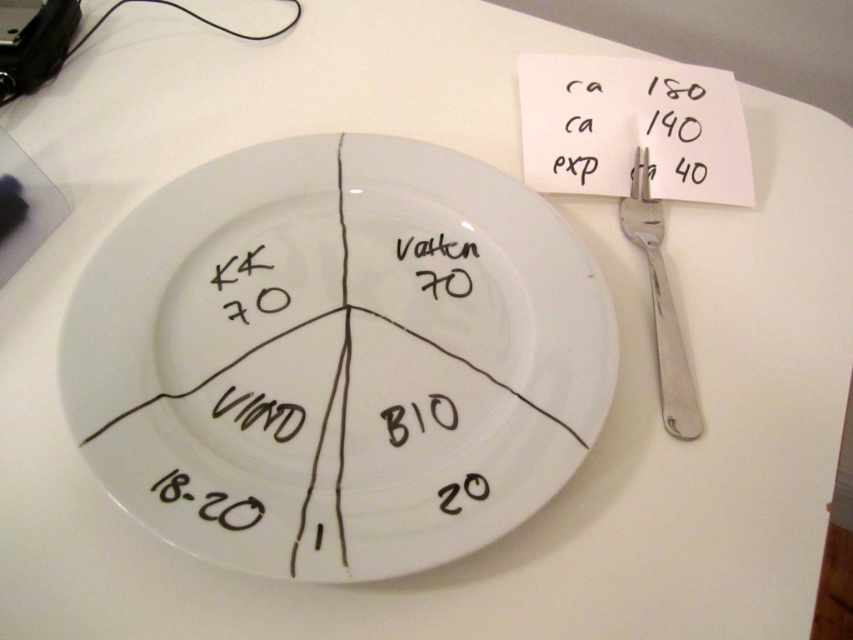
Question: Can you confirm if white paper at upper right is positioned to the left of white matte text at center?

Choices:
 (A) yes
 (B) no

Answer: (B)

Question: Which object is the closest to the white ceramic plate at center?

Choices:
 (A) satin silver fork at right
 (B) white paper at upper right
 (C) white matte text at center

Answer: (C)

Question: Based on their relative distances, which object is nearer to the white ceramic plate at center?

Choices:
 (A) white paper at upper right
 (B) satin silver fork at right

Answer: (A)

Question: Can you confirm if white paper at upper right is positioned to the left of white matte text at center?

Choices:
 (A) yes
 (B) no

Answer: (B)

Question: Can you confirm if white ceramic plate at center is positioned to the right of white paper at upper right?

Choices:
 (A) no
 (B) yes

Answer: (A)

Question: Which object is positioned closest to the white paper at upper right?

Choices:
 (A) white ceramic plate at center
 (B) satin silver fork at right
 (C) white matte text at center

Answer: (B)